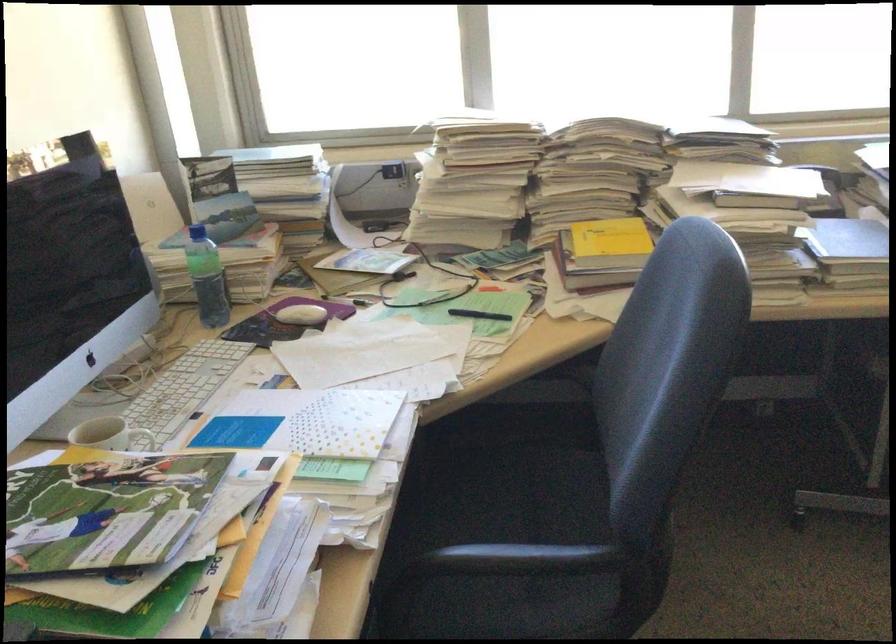
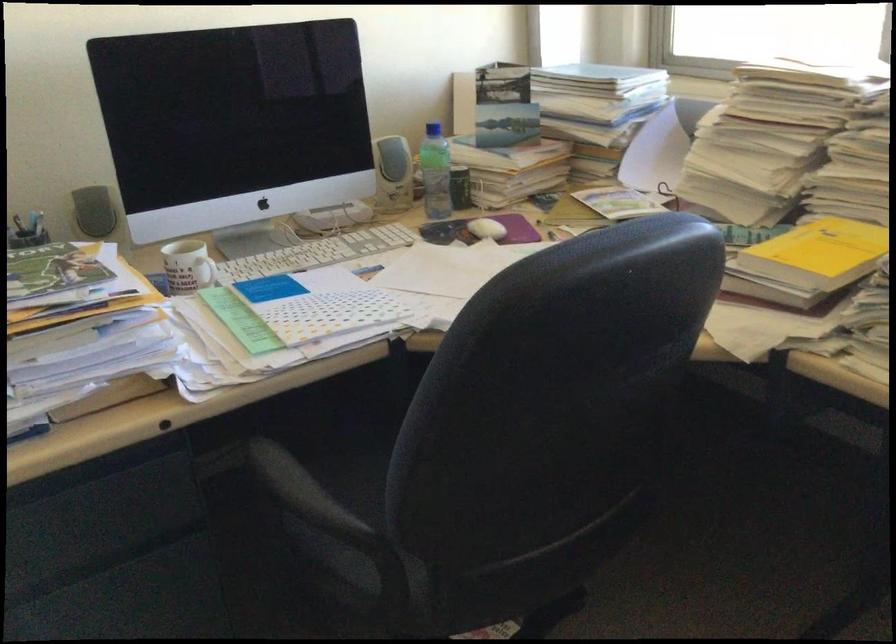
Find the pixel in the second image that matches (207,234) in the first image.

(433, 129)